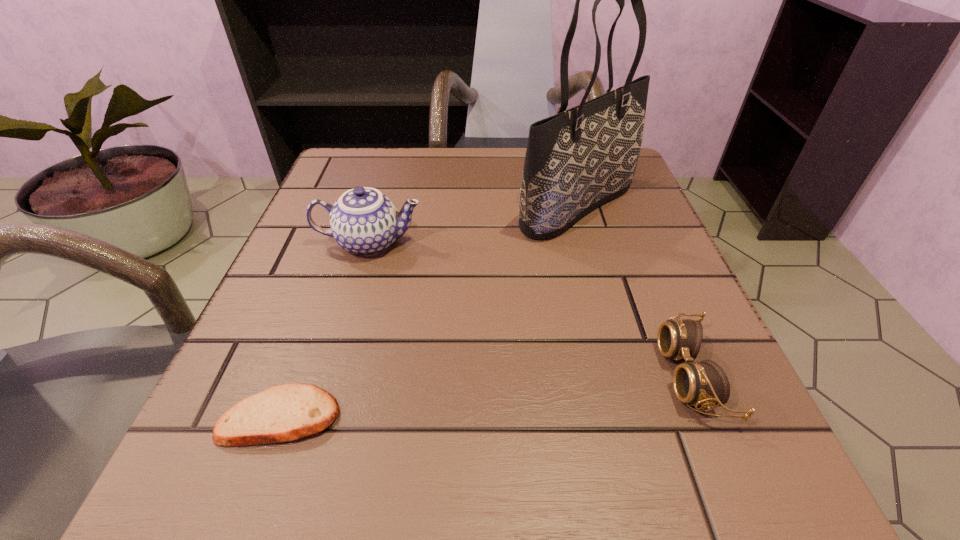
Where is `object that is at the far edge`? Image resolution: width=960 pixels, height=540 pixels. object that is at the far edge is located at coordinates (576, 160).

This screenshot has height=540, width=960. In order to click on object at the near edge in this screenshot , I will do `click(288, 412)`.

Image resolution: width=960 pixels, height=540 pixels. What are the coordinates of `chinaware that is at the left edge` in the screenshot? It's located at pyautogui.click(x=363, y=221).

Identify the location of pita bread at the left edge. (288, 412).

Find the location of a particular element. tote bag that is at the right edge is located at coordinates (576, 160).

At what (x,y) coordinates should I click in order to perform the action: click on goggles positioned at the right edge. Please return your answer as a coordinate pair (x, y). Looking at the image, I should click on (701, 383).

Locate an element on the screen. object that is at the near left corner is located at coordinates click(x=288, y=412).

At what (x,y) coordinates should I click in order to perform the action: click on object present at the far right corner. Please return your answer as a coordinate pair (x, y). Looking at the image, I should click on (576, 160).

Locate an element on the screen. vacant area at the far edge of the desktop is located at coordinates (435, 171).

You are a GUI agent. You are given a task and a screenshot of the screen. Output one action in this format:
    pyautogui.click(x=<x>, y=<y>)
    Task: Click on the free space at the near edge
    The width and height of the screenshot is (960, 540).
    Given the screenshot: What is the action you would take?
    [326, 480]